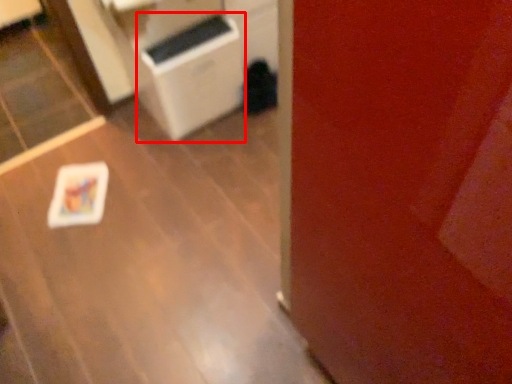
Question: Observing the image, what is the correct spatial positioning of appliance (annotated by the red box) in reference to table?

Choices:
 (A) right
 (B) left

Answer: (A)